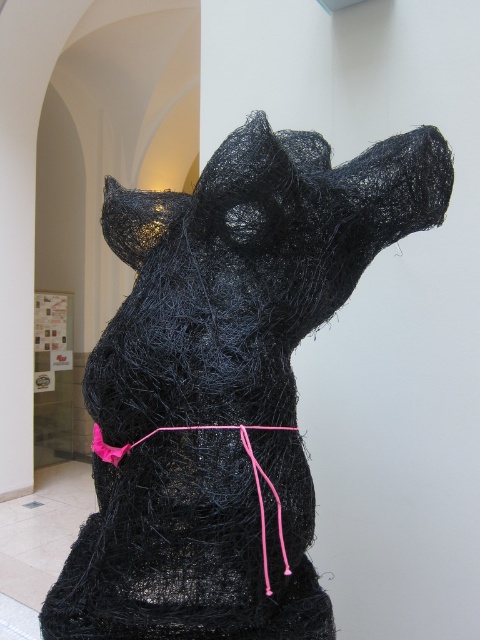
You are an artist who wants to hang a small decorative bell from the tallest object in the image. Which object should you choose between the black wire mesh dog at center and the pink fabric string at center?

The black wire mesh dog at center is taller than the pink fabric string at center, so you should hang the bell from the black wire mesh dog at center.

You are an art installer and need to determine if the pink fabric string at center can be safely replaced with a wider ribbon without altering the balance of the black wire mesh dog at center. Based on their sizes, is this feasible?

The black wire mesh dog at center is wider than the pink fabric string at center. Since the ribbon is wider than the current string, it might disrupt the balance unless adjustments are made to accommodate the increased width.

You are an artist who wants to hang a small golden bell on the black wire mesh dog at center so that it hangs to the right side of the pink fabric string at center. Is this possible given their positions?

Answer: The black wire mesh dog at center is to the left of the pink fabric string at center. Therefore, placing the bell on the dog so it hangs to the right of the string is possible since the dog is already positioned to the left of the string.